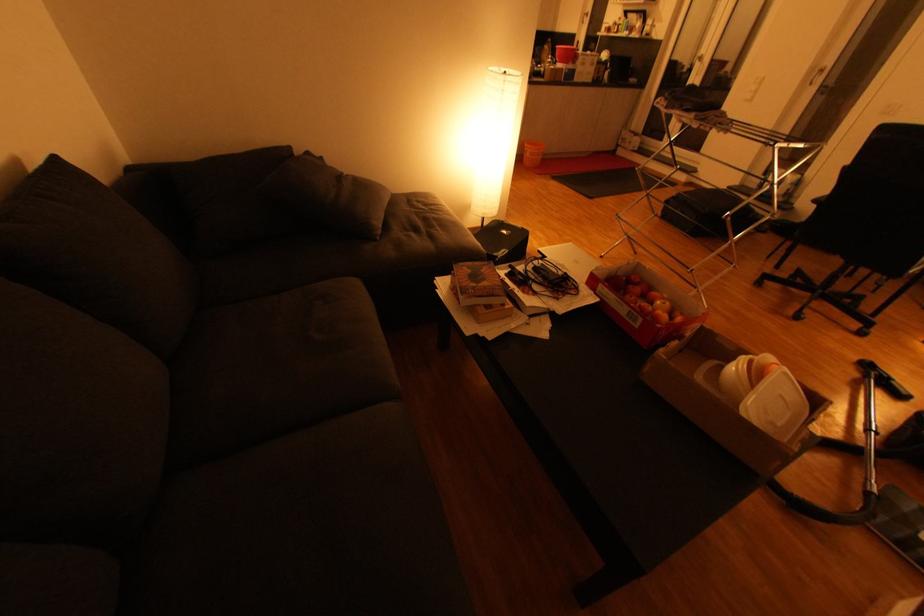
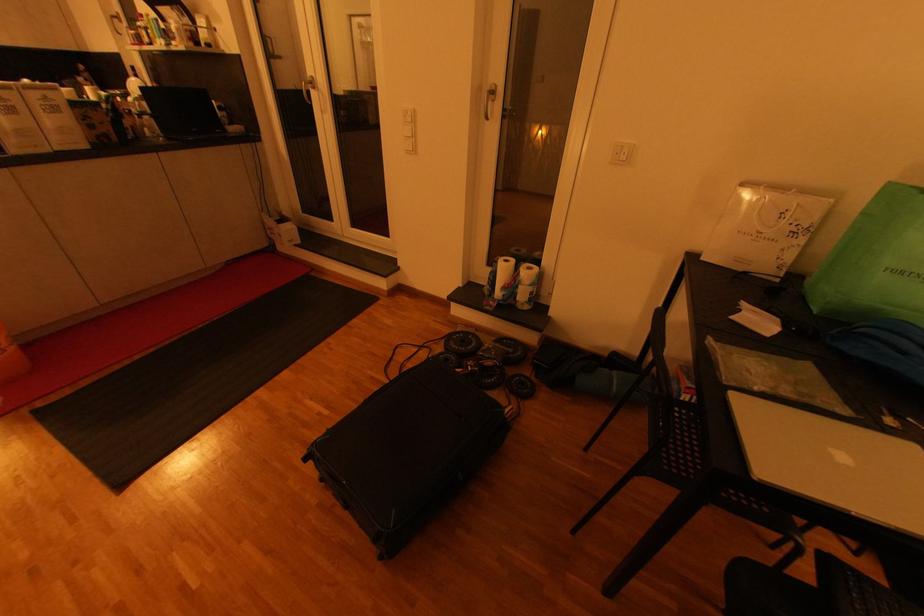
Find the pixel in the second image that matches the point at 759,89 in the first image.

(412, 131)